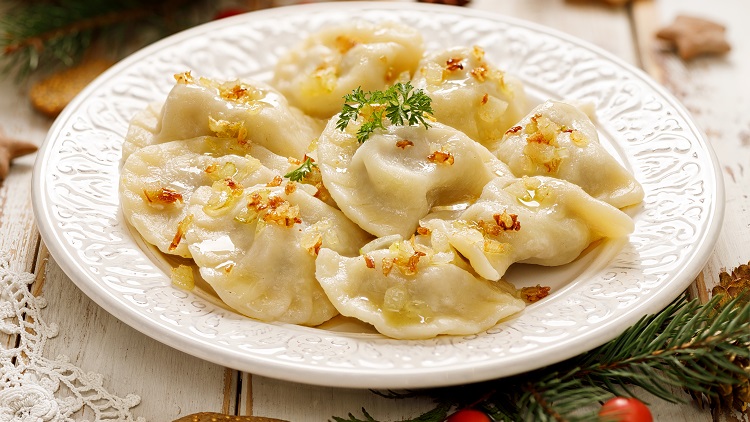
The image size is (750, 422). Find the location of `wooden table background`. wooden table background is located at coordinates (26, 189), (73, 337), (190, 388), (277, 401), (390, 409), (594, 28), (712, 118), (742, 24), (734, 238).